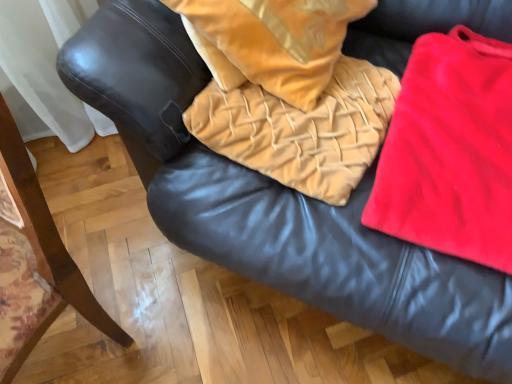
The image size is (512, 384). Find the location of `unoccupied space behind matte black armrest at left`. unoccupied space behind matte black armrest at left is located at coordinates (86, 206).